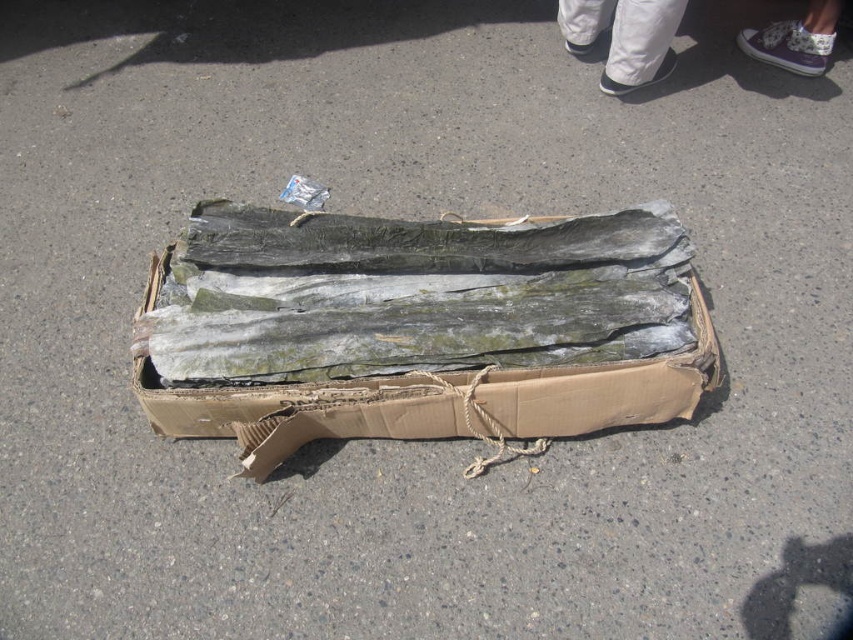
Is brown cardboard box at center thinner than white fabric pants at upper center?

Incorrect, brown cardboard box at center's width is not less than white fabric pants at upper center's.

This screenshot has height=640, width=853. I want to click on brown cardboard box at center, so click(x=419, y=328).

What do you see at coordinates (419, 328) in the screenshot? I see `brown cardboard box at center` at bounding box center [419, 328].

Locate an element on the screen. The image size is (853, 640). brown cardboard box at center is located at coordinates (419, 328).

Looking at this image, can you confirm if brown cardboard box at center is shorter than greenish-gray wood at center?

No, brown cardboard box at center is not shorter than greenish-gray wood at center.

Describe the element at coordinates (419, 328) in the screenshot. I see `brown cardboard box at center` at that location.

Locate an element on the screen. This screenshot has height=640, width=853. brown cardboard box at center is located at coordinates (419, 328).

Does greenish-gray wood at center appear under white fabric pants at upper center?

Correct, greenish-gray wood at center is located below white fabric pants at upper center.

Locate an element on the screen. Image resolution: width=853 pixels, height=640 pixels. greenish-gray wood at center is located at coordinates (422, 243).

Where is `greenish-gray wood at center`? The image size is (853, 640). greenish-gray wood at center is located at coordinates (422, 243).